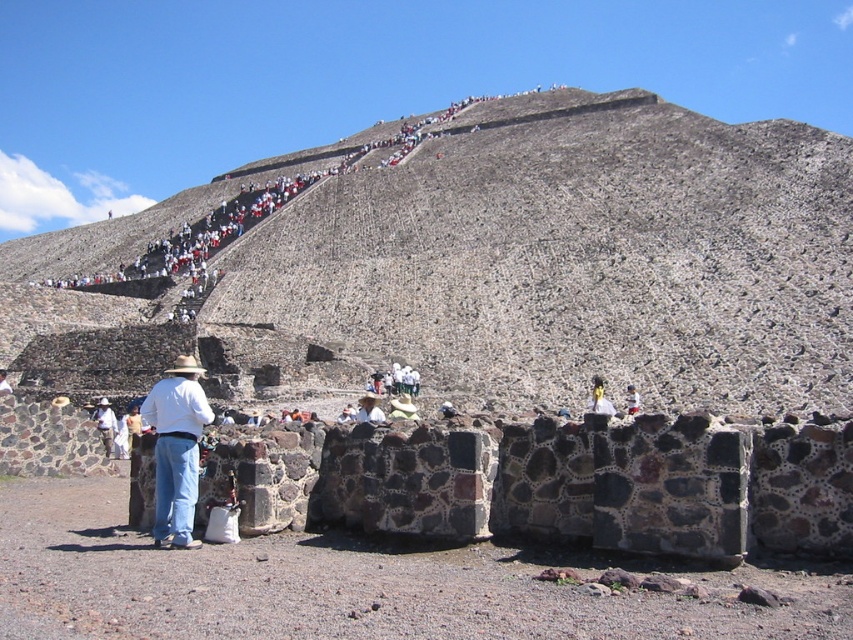
Question: Does white cotton shirt at center come behind light blue denim jeans at lower center?

Choices:
 (A) no
 (B) yes

Answer: (A)

Question: Is rough stone pyramid at upper center smaller than white cotton shirt at center?

Choices:
 (A) yes
 (B) no

Answer: (B)

Question: Which object is farther from the camera taking this photo?

Choices:
 (A) white woven hat at center
 (B) white cotton shirt at center
 (C) light blue denim jeans at lower center

Answer: (C)

Question: Does white cotton shirt at center have a larger size compared to light blue denim jeans at lower center?

Choices:
 (A) yes
 (B) no

Answer: (A)

Question: Which object is closer to the camera taking this photo?

Choices:
 (A) white woven hat at center
 (B) light blue denim jeans at lower center

Answer: (A)

Question: Among these points, which one is farthest from the camera?

Choices:
 (A) (741, 269)
 (B) (631, 406)
 (C) (112, 422)
 (D) (184, 449)

Answer: (A)